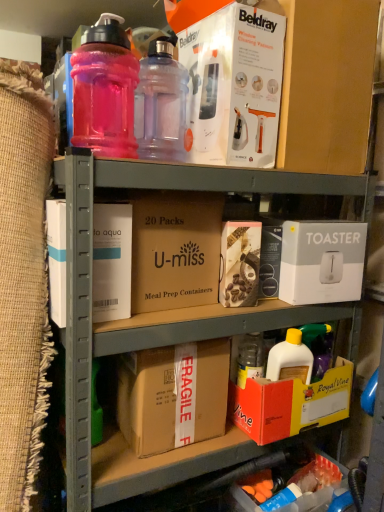
Identify the location of orange cardboard box at lower right, which is counted as the second box, starting from the bottom. The image size is (384, 512). (290, 404).

This screenshot has height=512, width=384. What do you see at coordinates (175, 249) in the screenshot? I see `brown cardboard at center, placed as the 1th cardboard box when sorted from top to bottom` at bounding box center [175, 249].

Where is `brown cardboard at center, placed as the 1th cardboard box when sorted from top to bottom`? This screenshot has width=384, height=512. brown cardboard at center, placed as the 1th cardboard box when sorted from top to bottom is located at coordinates [x=175, y=249].

What do you see at coordinates (240, 263) in the screenshot?
I see `pink matte box at center, the 2th box in the top-to-bottom sequence` at bounding box center [240, 263].

The width and height of the screenshot is (384, 512). Describe the element at coordinates (233, 80) in the screenshot. I see `white cardboard box at upper center, the first box from the top` at that location.

The width and height of the screenshot is (384, 512). I want to click on white cardboard box at upper center, which appears as the fifth box when ordered from the bottom, so click(x=233, y=80).

The height and width of the screenshot is (512, 384). Identify the location of white cardboard toaster at right, which ranks as the third box in top-to-bottom order. (322, 261).

How different are the orientations of translucent pink plastic bottle at upper left, the 2th bottle positioned from the right, and brown cardboard at center, placed as the 1th cardboard box when sorted from top to bottom, in degrees?

translucent pink plastic bottle at upper left, the 2th bottle positioned from the right, and brown cardboard at center, placed as the 1th cardboard box when sorted from top to bottom, are facing 1.33 degrees away from each other.

From the image's perspective, who appears lower, translucent pink plastic bottle at upper left, which appears as the 1th bottle when viewed from the left, or brown cardboard at center, the 2th cardboard box ordered from the bottom?

brown cardboard at center, the 2th cardboard box ordered from the bottom, appears lower in the image.

Is the surface of translucent pink plastic bottle at upper left, which appears as the 1th bottle when viewed from the left, in direct contact with brown cardboard at center, placed as the 1th cardboard box when sorted from top to bottom?

No, translucent pink plastic bottle at upper left, which appears as the 1th bottle when viewed from the left, is not beside brown cardboard at center, placed as the 1th cardboard box when sorted from top to bottom.

Can you confirm if brown cardboard at center, the 2th cardboard box ordered from the bottom, is shorter than orange cardboard box at lower right, arranged as the first box when ordered from the bottom?

Incorrect, the height of brown cardboard at center, the 2th cardboard box ordered from the bottom, does not fall short of that of orange cardboard box at lower right, arranged as the first box when ordered from the bottom.

Which is behind, point (174, 275) or point (342, 466)?

The point (342, 466) is farther.

How many degrees apart are the facing directions of brown cardboard at center, the 2th cardboard box ordered from the bottom, and orange cardboard box at lower right, arranged as the first box when ordered from the bottom?

brown cardboard at center, the 2th cardboard box ordered from the bottom, and orange cardboard box at lower right, arranged as the first box when ordered from the bottom, are facing 90.9 degrees away from each other.

Which object is more forward, brown cardboard at center, the 2th cardboard box ordered from the bottom, or pink matte box at center, the 2th box in the top-to-bottom sequence?

brown cardboard at center, the 2th cardboard box ordered from the bottom, is in front.

Identify the location of box that is the 2nd object to the right of the brown cardboard at center, the 2th cardboard box ordered from the bottom, starting at the anchor. (240, 263).

In the scene shown: Is brown cardboard at center, the 2th cardboard box ordered from the bottom, located outside pink matte box at center, the 2th box in the top-to-bottom sequence?

Yes.

Which is in front, brown cardboard box at center, acting as the second cardboard box starting from the top, or orange cardboard box at lower right, which is counted as the second box, starting from the bottom?

brown cardboard box at center, acting as the second cardboard box starting from the top, is in front.

Is brown cardboard box at center, which is counted as the 1th cardboard box, starting from the bottom, oriented away from orange cardboard box at lower right, the fourth box when ordered from top to bottom?

brown cardboard box at center, which is counted as the 1th cardboard box, starting from the bottom, is not turned away from orange cardboard box at lower right, the fourth box when ordered from top to bottom.

Is brown cardboard box at center, which is counted as the 1th cardboard box, starting from the bottom, surrounding orange cardboard box at lower right, the fourth box when ordered from top to bottom?

No.

From the image's perspective, is brown cardboard box at center, acting as the second cardboard box starting from the top, under orange cardboard box at lower right, which is counted as the second box, starting from the bottom?

Incorrect, from the image's perspective, brown cardboard box at center, acting as the second cardboard box starting from the top, is higher than orange cardboard box at lower right, which is counted as the second box, starting from the bottom.

From the image's perspective, would you say orange cardboard box at lower right, arranged as the first box when ordered from the bottom, is shown under orange cardboard box at lower right, the fourth box when ordered from top to bottom?

Yes, from the image's perspective, orange cardboard box at lower right, arranged as the first box when ordered from the bottom, is beneath orange cardboard box at lower right, the fourth box when ordered from top to bottom.

Between orange cardboard box at lower right, which is the 5th box from top to bottom, and orange cardboard box at lower right, which is counted as the second box, starting from the bottom, which one has smaller width?

orange cardboard box at lower right, which is the 5th box from top to bottom.

Could you tell me if orange cardboard box at lower right, which is the 5th box from top to bottom, is facing orange cardboard box at lower right, the fourth box when ordered from top to bottom?

No, orange cardboard box at lower right, which is the 5th box from top to bottom, is not oriented towards orange cardboard box at lower right, the fourth box when ordered from top to bottom.

Does transparent plastic bottle at upper center, which is the 2th bottle in left-to-right order, have a larger size compared to translucent pink plastic bottle at upper left, the 2th bottle positioned from the right?

No.

Is transparent plastic bottle at upper center, positioned as the 1th bottle in right-to-left order, far from translucent pink plastic bottle at upper left, which appears as the 1th bottle when viewed from the left?

That's not correct — transparent plastic bottle at upper center, positioned as the 1th bottle in right-to-left order, is a little close to translucent pink plastic bottle at upper left, which appears as the 1th bottle when viewed from the left.

Which object is positioned more to the left, transparent plastic bottle at upper center, positioned as the 1th bottle in right-to-left order, or translucent pink plastic bottle at upper left, which appears as the 1th bottle when viewed from the left?

Positioned to the left is translucent pink plastic bottle at upper left, which appears as the 1th bottle when viewed from the left.

Is transparent plastic bottle at upper center, positioned as the 1th bottle in right-to-left order, in front of or behind translucent pink plastic bottle at upper left, the 2th bottle positioned from the right, in the image?

Visually, transparent plastic bottle at upper center, positioned as the 1th bottle in right-to-left order, is located behind translucent pink plastic bottle at upper left, the 2th bottle positioned from the right.

Which object is thinner, transparent plastic bottle at upper center, positioned as the 1th bottle in right-to-left order, or brown cardboard box at center, acting as the second cardboard box starting from the top?

With smaller width is transparent plastic bottle at upper center, positioned as the 1th bottle in right-to-left order.

Consider the image. In the image, is transparent plastic bottle at upper center, which is the 2th bottle in left-to-right order, on the left side or the right side of brown cardboard box at center, acting as the second cardboard box starting from the top?

transparent plastic bottle at upper center, which is the 2th bottle in left-to-right order, is positioned on brown cardboard box at center, acting as the second cardboard box starting from the top,'s right side.

From a real-world perspective, is transparent plastic bottle at upper center, which is the 2th bottle in left-to-right order, on top of brown cardboard box at center, acting as the second cardboard box starting from the top?

Correct, in the physical world, transparent plastic bottle at upper center, which is the 2th bottle in left-to-right order, is higher than brown cardboard box at center, acting as the second cardboard box starting from the top.

Which of these two, transparent plastic bottle at upper center, positioned as the 1th bottle in right-to-left order, or brown cardboard box at center, acting as the second cardboard box starting from the top, is bigger?

Bigger between the two is brown cardboard box at center, acting as the second cardboard box starting from the top.

At what (x,y) coordinates should I click in order to perform the action: click on the 1st cardboard box positioned below the translucent pink plastic bottle at upper left, which appears as the 1th bottle when viewed from the left (from the image's perspective). Please return your answer as a coordinate pair (x, y). This screenshot has height=512, width=384. Looking at the image, I should click on (175, 249).

Image resolution: width=384 pixels, height=512 pixels. I want to click on the 2nd cardboard box above the orange cardboard box at lower right, arranged as the first box when ordered from the bottom (from a real-world perspective), so click(175, 249).

When comparing their distances from brown cardboard box at center, which is counted as the 1th cardboard box, starting from the bottom, does white cardboard toaster at right, which ranks as the third box in top-to-bottom order, or orange cardboard box at lower right, the fourth box when ordered from top to bottom, seem closer?

orange cardboard box at lower right, the fourth box when ordered from top to bottom, lies closer to brown cardboard box at center, which is counted as the 1th cardboard box, starting from the bottom, than the other object.

Based on their spatial positions, is white cardboard toaster at right, which ranks as the third box in top-to-bottom order, or brown cardboard box at center, acting as the second cardboard box starting from the top, closer to brown cardboard at center, the 2th cardboard box ordered from the bottom?

brown cardboard box at center, acting as the second cardboard box starting from the top.

When comparing their distances from orange cardboard box at lower right, which is the 5th box from top to bottom, does brown cardboard at center, placed as the 1th cardboard box when sorted from top to bottom, or brown cardboard box at center, which is counted as the 1th cardboard box, starting from the bottom, seem closer?

Based on the image, brown cardboard box at center, which is counted as the 1th cardboard box, starting from the bottom, appears to be nearer to orange cardboard box at lower right, which is the 5th box from top to bottom.

Estimate the real-world distances between objects in this image. Which object is further from white cardboard toaster at right, positioned as the third box in bottom-to-top order, transparent plastic bottle at upper center, which is the 2th bottle in left-to-right order, or orange cardboard box at lower right, arranged as the first box when ordered from the bottom?

orange cardboard box at lower right, arranged as the first box when ordered from the bottom, is further to white cardboard toaster at right, positioned as the third box in bottom-to-top order.

When comparing their distances from white cardboard box at upper center, which appears as the fifth box when ordered from the bottom, does orange cardboard box at lower right, the fourth box when ordered from top to bottom, or brown cardboard at center, placed as the 1th cardboard box when sorted from top to bottom, seem further?

The object further to white cardboard box at upper center, which appears as the fifth box when ordered from the bottom, is orange cardboard box at lower right, the fourth box when ordered from top to bottom.

Which object lies nearer to the anchor point transparent plastic bottle at upper center, positioned as the 1th bottle in right-to-left order, brown cardboard at center, placed as the 1th cardboard box when sorted from top to bottom, or white cardboard toaster at right, positioned as the third box in bottom-to-top order?

brown cardboard at center, placed as the 1th cardboard box when sorted from top to bottom.

Which object lies further to the anchor point white cardboard box at upper center, the first box from the top, brown cardboard at center, placed as the 1th cardboard box when sorted from top to bottom, or pink matte box at center, which is the 4th box from bottom to top?

pink matte box at center, which is the 4th box from bottom to top, is further to white cardboard box at upper center, the first box from the top.

Which object lies further to the anchor point brown cardboard at center, placed as the 1th cardboard box when sorted from top to bottom, translucent pink plastic bottle at upper left, the 2th bottle positioned from the right, or orange cardboard box at lower right, which is the 5th box from top to bottom?

The object further to brown cardboard at center, placed as the 1th cardboard box when sorted from top to bottom, is orange cardboard box at lower right, which is the 5th box from top to bottom.

At what (x,y) coordinates should I click in order to perform the action: click on bottle between transparent plastic bottle at upper center, positioned as the 1th bottle in right-to-left order, and brown cardboard at center, the 2th cardboard box ordered from the bottom, from top to bottom. Please return your answer as a coordinate pair (x, y). Looking at the image, I should click on (105, 90).

Identify the location of box between white cardboard box at upper center, which appears as the fifth box when ordered from the bottom, and white cardboard toaster at right, positioned as the third box in bottom-to-top order, from top to bottom. (240, 263).

Identify the location of bottle between transparent plastic bottle at upper center, positioned as the 1th bottle in right-to-left order, and orange cardboard box at lower right, which is counted as the second box, starting from the bottom, from top to bottom. (105, 90).

I want to click on bottle between translucent pink plastic bottle at upper left, which appears as the 1th bottle when viewed from the left, and white cardboard box at upper center, which appears as the fifth box when ordered from the bottom, so click(161, 104).